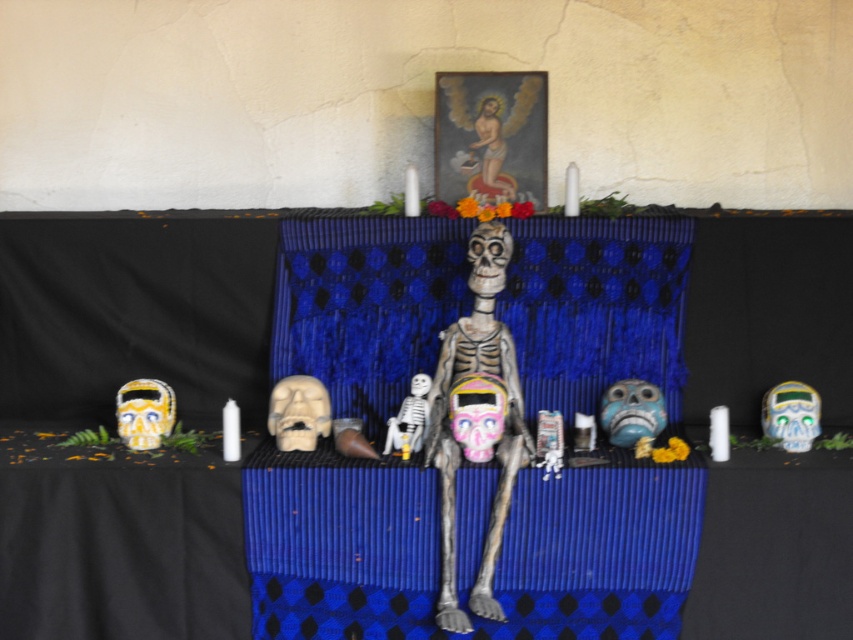
Question: Which object appears closest to the camera in this image?

Choices:
 (A) matte white skull at center
 (B) golden beaded skull at left

Answer: (A)

Question: Can you confirm if blue fabric table at center is positioned below white matte skull at center?

Choices:
 (A) no
 (B) yes

Answer: (B)

Question: Which object is farther from the camera taking this photo?

Choices:
 (A) painted ceramic skull at center
 (B) white matte skeleton at center

Answer: (B)

Question: Which of these objects is positioned farthest from the white matte skull at center?

Choices:
 (A) painted ceramic skull at center
 (B) shiny blue skull at right
 (C) matte white skull at center

Answer: (B)

Question: Is smooth wooden figure at upper center further to camera compared to white matte skeleton at center?

Choices:
 (A) no
 (B) yes

Answer: (B)

Question: Does smooth painted skeleton at center have a smaller size compared to white matte skeleton at center?

Choices:
 (A) no
 (B) yes

Answer: (A)